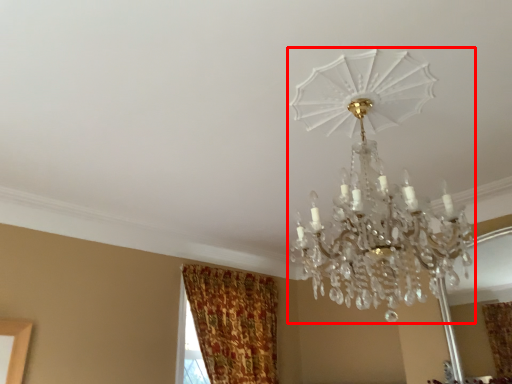
Question: Considering the relative positions of lamp (annotated by the red box) and curtain in the image provided, where is lamp (annotated by the red box) located with respect to the staircase?

Choices:
 (A) right
 (B) left

Answer: (A)